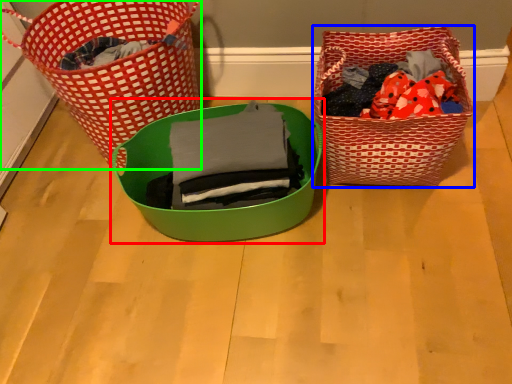
Question: Based on their relative distances, which object is farther from gift basket (highlighted by a red box)? Choose from picnic basket (highlighted by a blue box) and picnic basket (highlighted by a green box).

Choices:
 (A) picnic basket
 (B) picnic basket

Answer: (B)